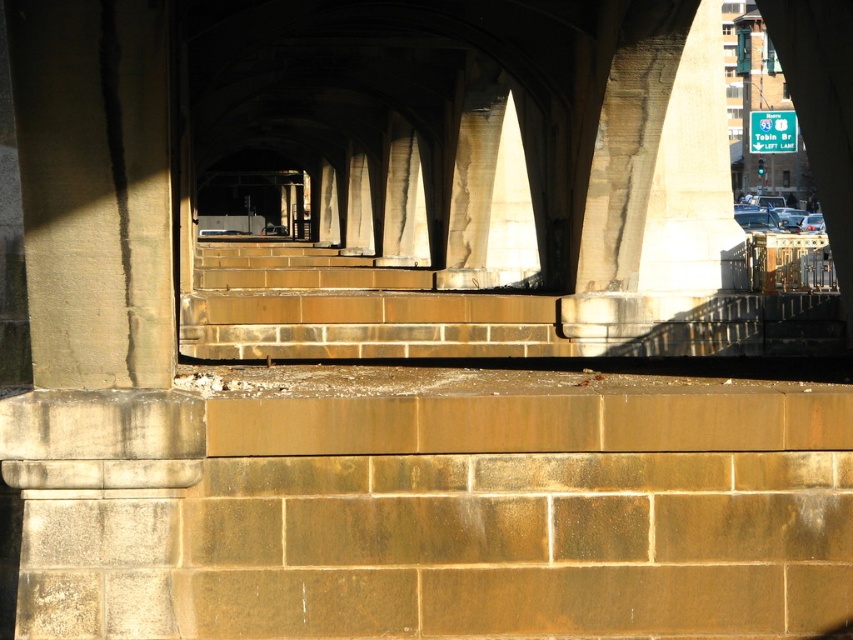
You are standing at the entrance of the arch structure and see the point marked at coordinates (x=465, y=314). What is the location of this point relative to the brown stone stairs at center?

The point marked at coordinates (x=465, y=314) is located on the brown stone stairs at center.

You are an architect designing a new pathway. You need to place a sign that is the same width as the green plastic sign at upper right next to the brown stone stairs at center. Will the sign fit without overlapping the stairs?

The brown stone stairs at center is wider than the green plastic sign at upper right, so the sign will fit next to the stairs without overlapping since it is narrower.